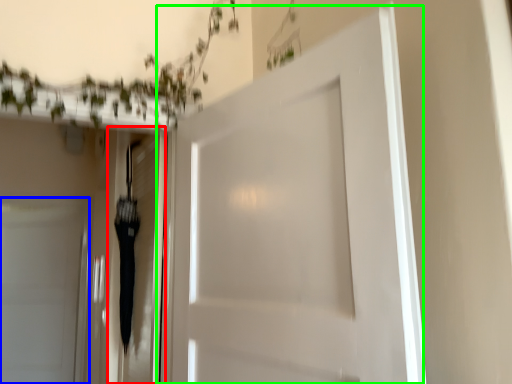
Question: Which object is the closest to the elevator (highlighted by a red box)? Choose among these: door (highlighted by a blue box) or door (highlighted by a green box).

Choices:
 (A) door
 (B) door

Answer: (B)